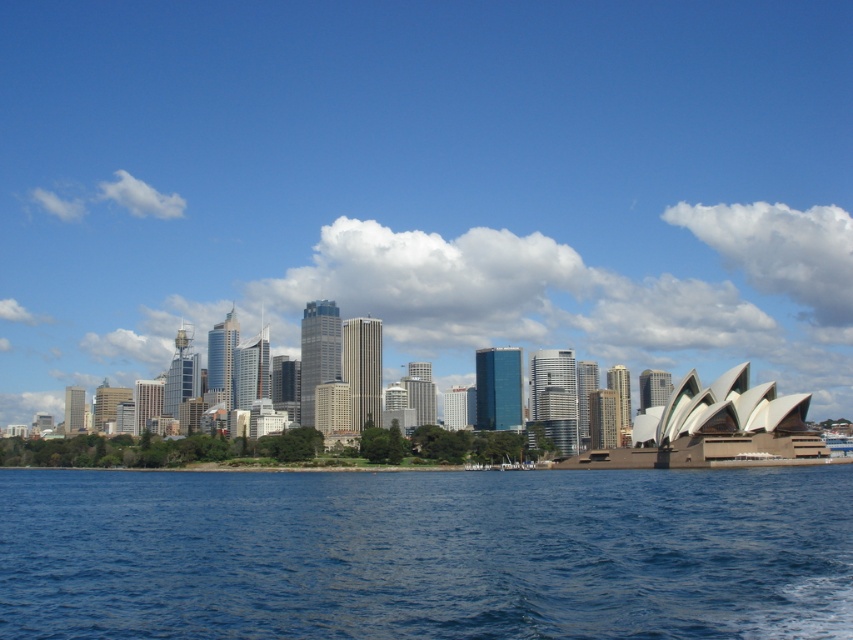
You are a photographer trying to capture the transparent glass skyline at center and the blue water at lower center in a single shot. Which object will appear closer to you in the photo?

The transparent glass skyline at center will appear closer to you in the photo because it is positioned further to the viewer than the blue water at lower center.

You are an architect analyzing the cityscape from the harbor. You observe the transparent glass skyline at center and the blue water at lower center. Which of these two elements occupies a greater visual area in the scene?

The transparent glass skyline at center is larger in size than the blue water at lower center, so it occupies a greater visual area in the scene.